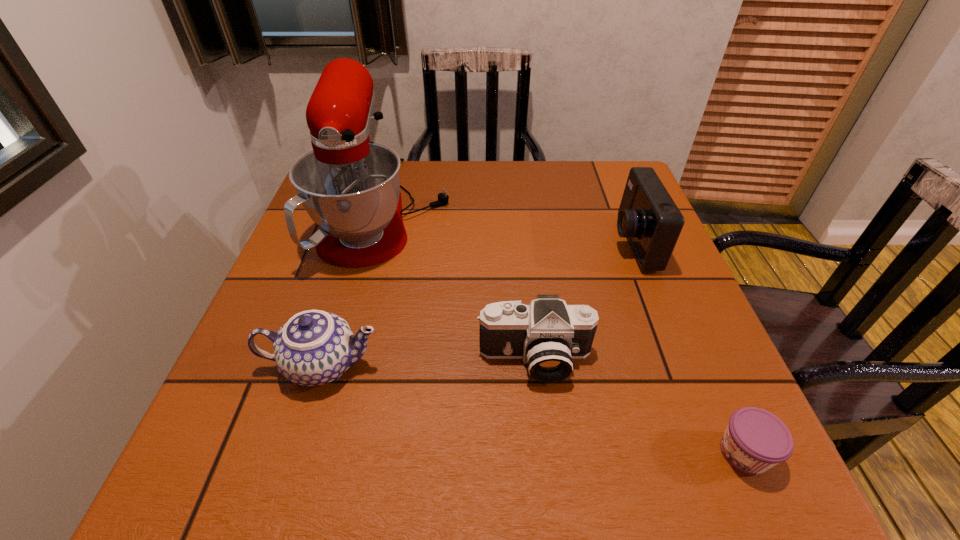
I want to click on camera present at the right edge, so click(x=649, y=218).

Locate an element on the screen. Image resolution: width=960 pixels, height=540 pixels. jam located in the right edge section of the desktop is located at coordinates (755, 440).

Image resolution: width=960 pixels, height=540 pixels. I want to click on object that is at the far left corner, so click(350, 187).

Where is `object that is at the near right corner`? The width and height of the screenshot is (960, 540). object that is at the near right corner is located at coordinates (755, 440).

This screenshot has width=960, height=540. I want to click on vacant space at the far edge of the desktop, so click(x=507, y=184).

Locate an element on the screen. Image resolution: width=960 pixels, height=540 pixels. vacant area at the near edge is located at coordinates (486, 450).

This screenshot has height=540, width=960. In order to click on free space at the left edge of the desktop in this screenshot , I will do `click(340, 275)`.

You are a GUI agent. You are given a task and a screenshot of the screen. Output one action in this format:
    pyautogui.click(x=<x>, y=<y>)
    Task: Click on the vacant space at the right edge of the desktop
    This screenshot has width=960, height=540.
    Given the screenshot: What is the action you would take?
    pyautogui.click(x=711, y=343)

Find the location of a particular element. free region at the far right corner of the desktop is located at coordinates (608, 183).

In the image, there is a desktop. Where is `vacant space at the near right corner`? Image resolution: width=960 pixels, height=540 pixels. vacant space at the near right corner is located at coordinates (706, 502).